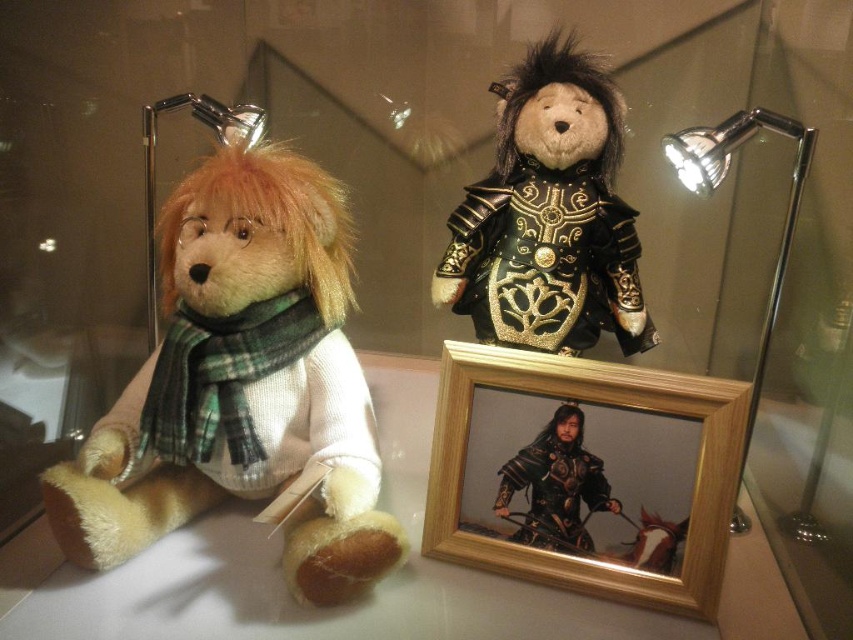
You are a visitor at the museum exhibit and notice two points marked on the glass case. The first point is labeled as point (294, 520) and the second is point (521, 461). Which of these two points is closer to the front of the glass case?

Point (294, 520) is in front of point (521, 461), so it is closer to the front of the glass case.